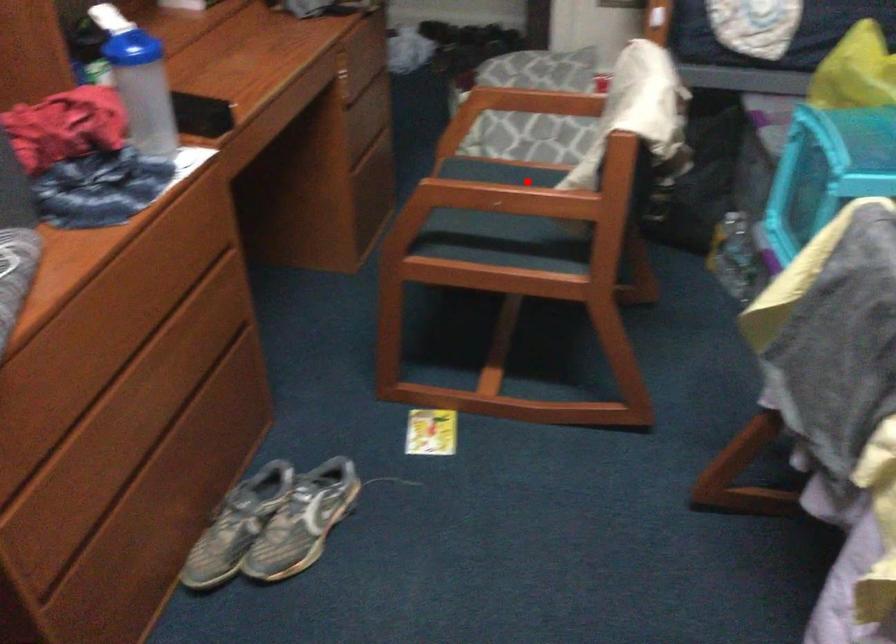
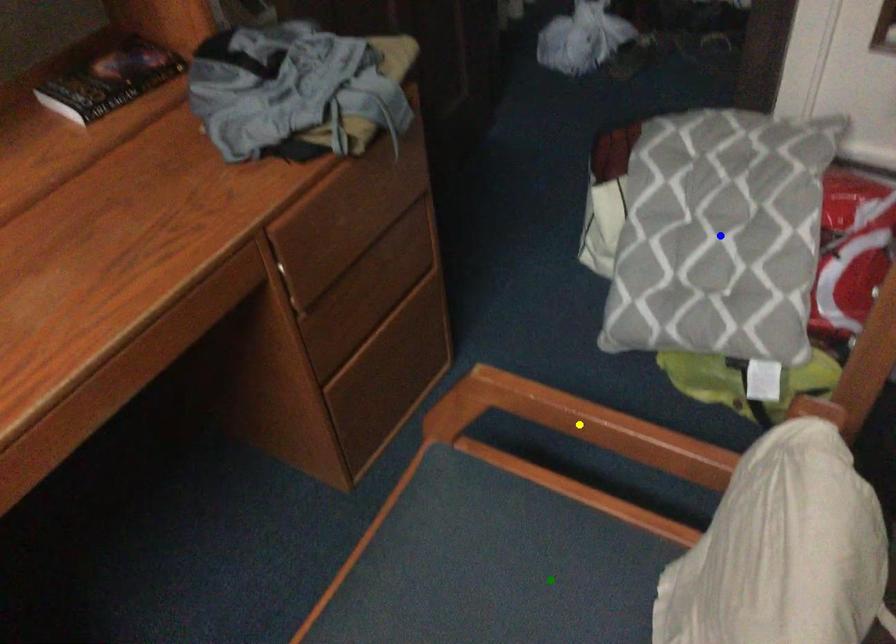
Question: I am providing you with two images of the same scene from different viewpoints. A red point is marked on the first image. You are given multiple points on the second image. In image 2, which mark is for the same physical point as the one in image 1?

Choices:
 (A) blue point
 (B) yellow point
 (C) green point

Answer: (C)